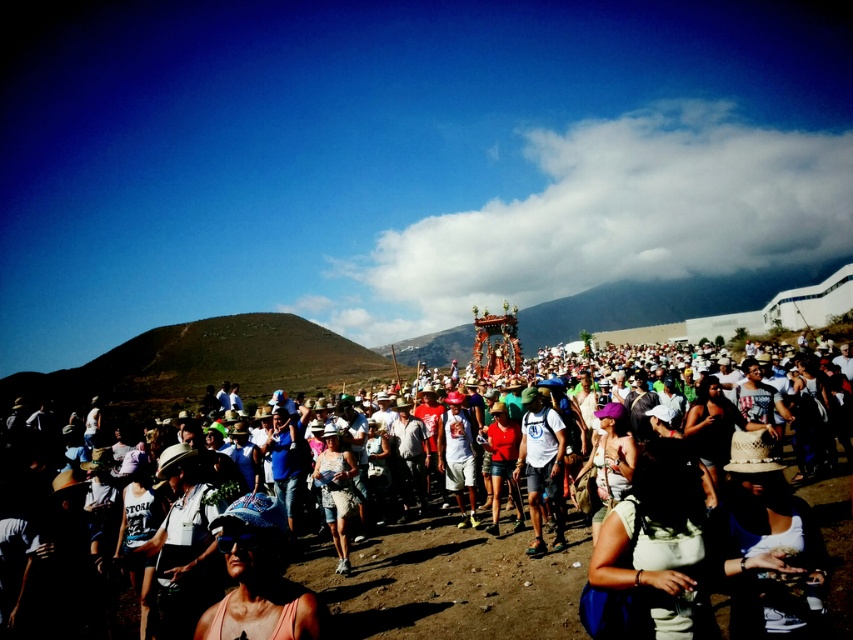
You are a photographer trying to capture a clear shot of the white cotton shorts at center. Given that the matte white crowd at center is blocking your view, can you estimate whether the crowd is large enough to completely obscure the shorts from your current position?

The matte white crowd at center is larger in size compared to the white cotton shorts at center, so it is likely that the crowd will completely obscure the shorts from your current position.